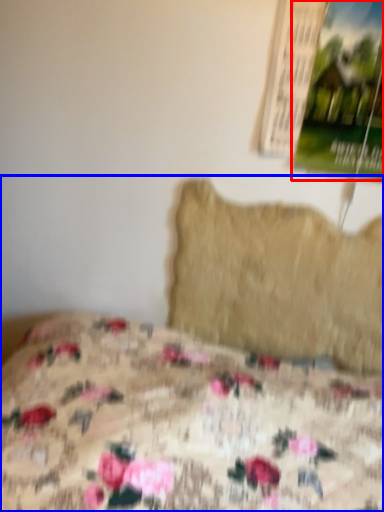
Question: Which point is closer to the camera, poster page (highlighted by a red box) or bed (highlighted by a blue box)?

Choices:
 (A) poster page
 (B) bed

Answer: (B)